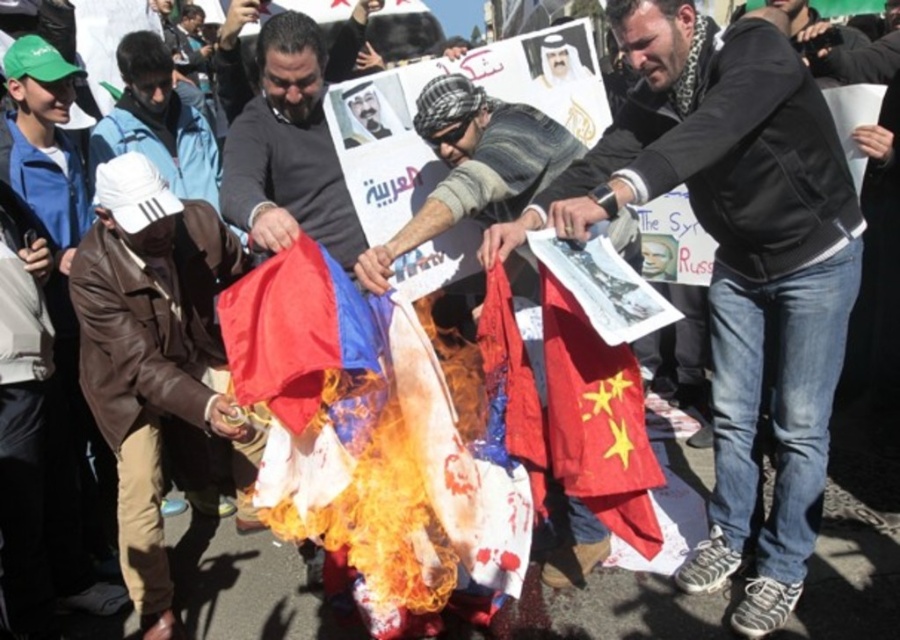
Question: Does white fabric cap at upper left come in front of smooth skin face at center?

Choices:
 (A) no
 (B) yes

Answer: (A)

Question: Among these points, which one is nearest to the camera?

Choices:
 (A) (232, 243)
 (B) (590, 326)

Answer: (B)

Question: Is red fabric flag at center to the right of smooth skin face at center from the viewer's perspective?

Choices:
 (A) yes
 (B) no

Answer: (A)

Question: Which of the following is the closest to the observer?

Choices:
 (A) (632, 456)
 (B) (150, 620)

Answer: (A)

Question: Does brown leather jacket at left lie behind white fabric cap at upper left?

Choices:
 (A) yes
 (B) no

Answer: (B)

Question: Which of the following is the farthest from the observer?

Choices:
 (A) brown leather jacket at left
 (B) shiny nylon flag at center
 (C) black hoodie at center

Answer: (A)